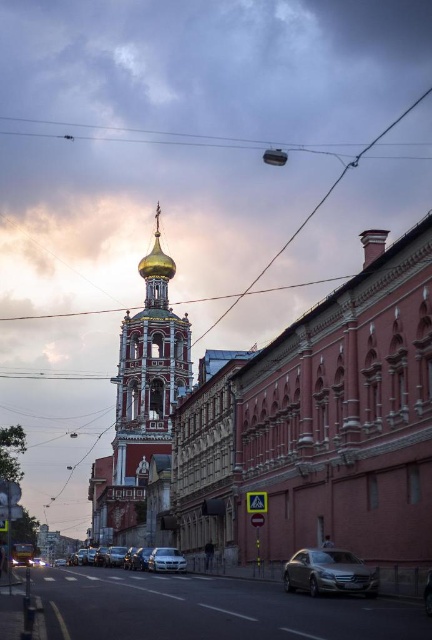
Looking at this image, can you confirm if gold domed church at upper left is positioned below silver metallic car at center?

Incorrect, gold domed church at upper left is not positioned below silver metallic car at center.

Which is behind, point (371, 484) or point (165, 561)?

The point (165, 561) is more distant.

The width and height of the screenshot is (432, 640). What are the coordinates of `gold domed church at upper left` in the screenshot? It's located at (320, 424).

Can you confirm if metallic wire at upper center is wider than satin silver sedan at lower right?

Indeed, metallic wire at upper center has a greater width compared to satin silver sedan at lower right.

Looking at this image, between metallic wire at upper center and satin silver sedan at lower right, which one appears on the right side from the viewer's perspective?

Positioned to the right is satin silver sedan at lower right.

The height and width of the screenshot is (640, 432). What are the coordinates of `metallic wire at upper center` in the screenshot? It's located at (171, 138).

Where is `metallic wire at upper center`? This screenshot has width=432, height=640. metallic wire at upper center is located at coordinates (171, 138).

Looking at this image, measure the distance between point (x=153, y=285) and camera.

Point (x=153, y=285) and camera are 152.53 meters apart.

Can you confirm if gold domed bell tower at center is thinner than metallic wire at upper center?

Yes, gold domed bell tower at center is thinner than metallic wire at upper center.

Who is more forward, (x=153, y=328) or (x=174, y=138)?

Point (x=153, y=328) is in front.

Image resolution: width=432 pixels, height=640 pixels. Identify the location of gold domed bell tower at center. (149, 371).